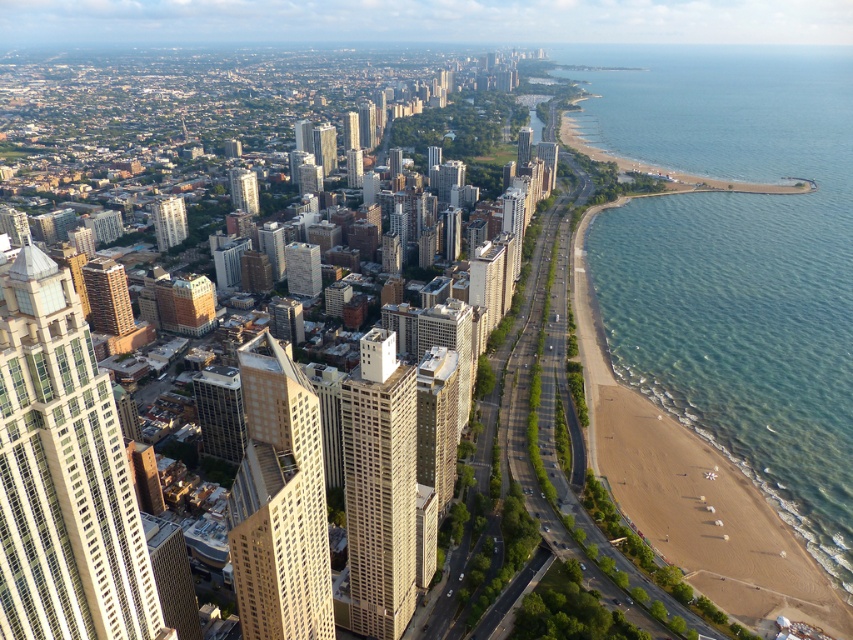
You are a drone operator tasked with capturing aerial footage of the coastal cityscape. Your camera is currently positioned at the point marked as point (735, 262). To ensure the best shot of the clear blue water at right, should you adjust your camera angle upwards or downwards?

The clear blue water at right is represented by point (735, 262), so to capture it, the drone operator should position the camera to face the direction of that point. Since the point is at (735, 262) on the coordinate system, which is likely in the lower right quadrant, the operator should angle the camera downwards to capture the clear blue water at right.